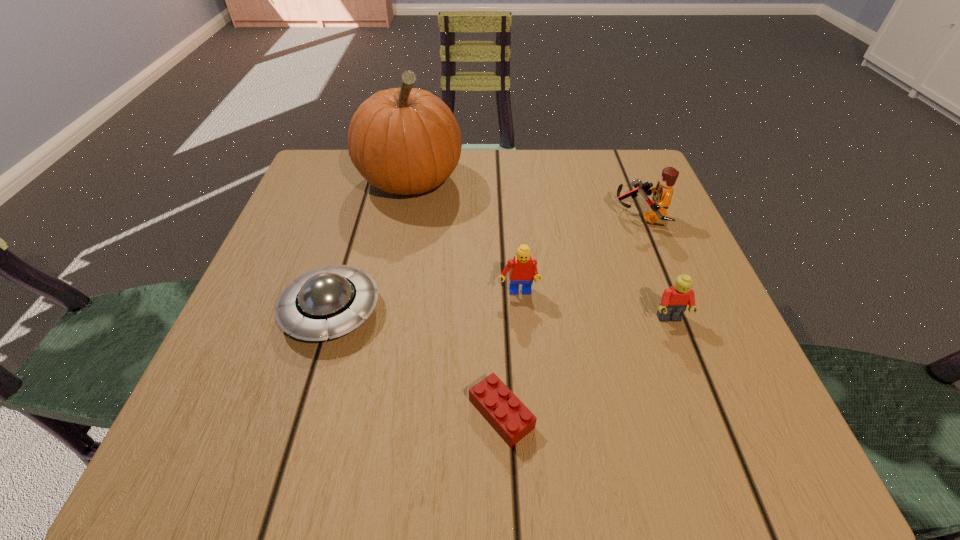
Locate an element on the screen. free space that is in between the third nearest Lego and the third farthest Lego is located at coordinates (593, 306).

Where is `unoccupied area between the fifth tallest object and the second nearest Lego`? The height and width of the screenshot is (540, 960). unoccupied area between the fifth tallest object and the second nearest Lego is located at coordinates (500, 315).

You are a GUI agent. You are given a task and a screenshot of the screen. Output one action in this format:
    pyautogui.click(x=<x>, y=<y>)
    Task: Click on the free spot between the farthest Lego and the saucer
    
    Given the screenshot: What is the action you would take?
    pyautogui.click(x=486, y=264)

You are a GUI agent. You are given a task and a screenshot of the screen. Output one action in this format:
    pyautogui.click(x=<x>, y=<y>)
    Task: Click on the free space between the saucer and the third farthest Lego
    
    Given the screenshot: What is the action you would take?
    pyautogui.click(x=500, y=315)

The image size is (960, 540). Find the location of `free space that is in between the second farthest Lego and the shortest Lego`. free space that is in between the second farthest Lego and the shortest Lego is located at coordinates (510, 354).

Where is `free space between the farthest Lego and the shortest object`? free space between the farthest Lego and the shortest object is located at coordinates (570, 315).

Where is `unoccupied area between the farthest Lego and the pumpkin`? unoccupied area between the farthest Lego and the pumpkin is located at coordinates (525, 198).

I want to click on free space that is in between the farthest Lego and the pumpkin, so click(x=525, y=198).

At what (x,y) coordinates should I click in order to perform the action: click on free area in between the farthest Lego and the shortest Lego. Please return your answer as a coordinate pair (x, y). Looking at the image, I should click on (570, 315).

Select which object appears as the closest to the shortest Lego. Please provide its 2D coordinates. Your answer should be formatted as a tuple, i.e. [(x, y)], where the tuple contains the x and y coordinates of a point satisfying the conditions above.

[(522, 269)]